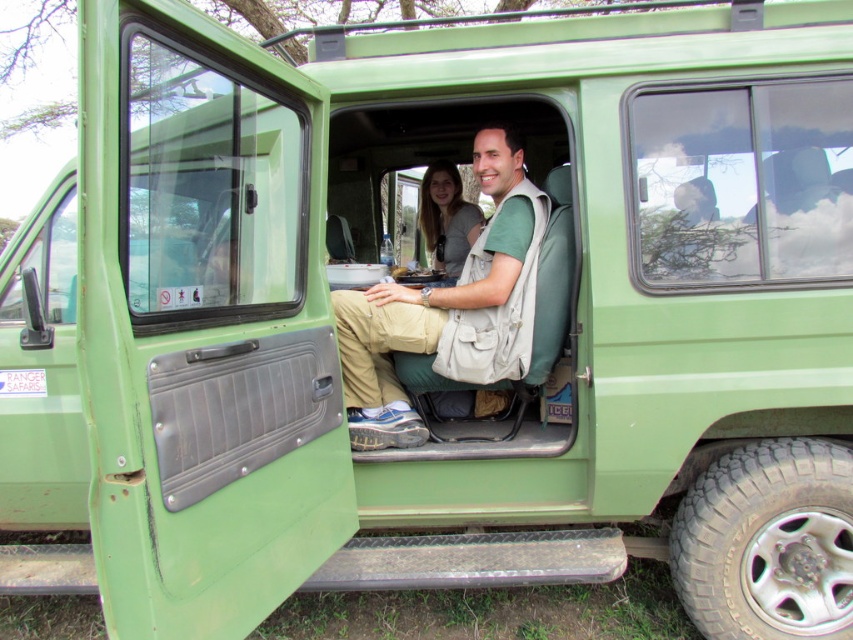
Question: Which object appears farthest from the camera in this image?

Choices:
 (A) matte khaki pants at center
 (B) matte gray sweater at center

Answer: (B)

Question: Does matte khaki pants at center appear over matte gray sweater at center?

Choices:
 (A) no
 (B) yes

Answer: (A)

Question: Does matte khaki pants at center have a larger size compared to matte gray sweater at center?

Choices:
 (A) no
 (B) yes

Answer: (B)

Question: Can you confirm if matte khaki pants at center is positioned below matte gray sweater at center?

Choices:
 (A) no
 (B) yes

Answer: (B)